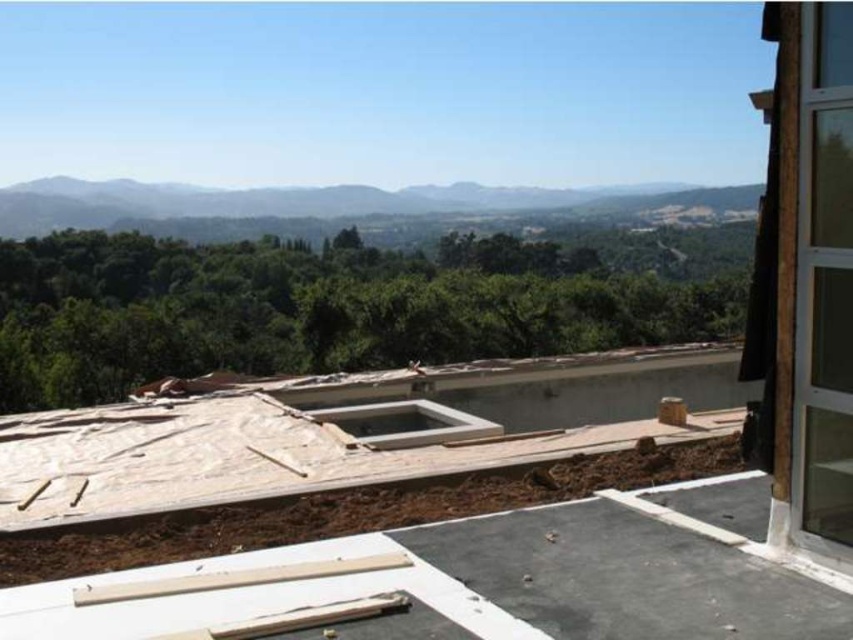
You are a construction worker carrying a 3.5 meter long steel beam. You need to move it from the wooden boards at center to the smooth concrete roof at center. Can you safely transport the beam horizontally between these two points without bending it?

The smooth concrete roof at center and wooden boards at center are 3.49 meters apart. Since the steel beam is 3.5 meters long, it is slightly longer than the distance between them. Therefore, you cannot safely transport the beam horizontally between these two points without bending it.

You are a construction worker standing on the wooden boards at center. You need to access the smooth concrete roof at center for inspection. Is the roof accessible from your current position?

The smooth concrete roof at center is located below the wooden boards at center, so you can access it by stepping down from the wooden boards at center.

You are an inspector checking the construction site. You notice the smooth concrete roof at center and the wooden boards at center. Which object is bigger in size?

The smooth concrete roof at center has a larger size compared to wooden boards at center, so the smooth concrete roof at center is bigger.